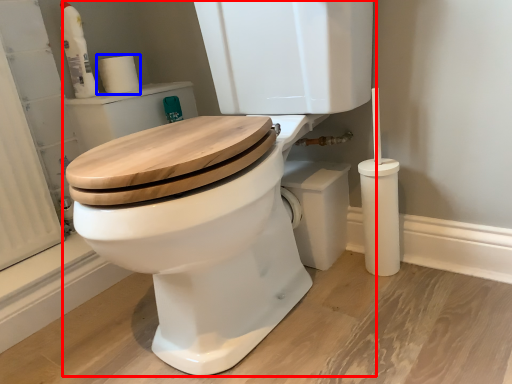
Question: Among these objects, which one is farthest to the camera, toilet (highlighted by a red box) or toilet paper (highlighted by a blue box)?

Choices:
 (A) toilet
 (B) toilet paper

Answer: (B)